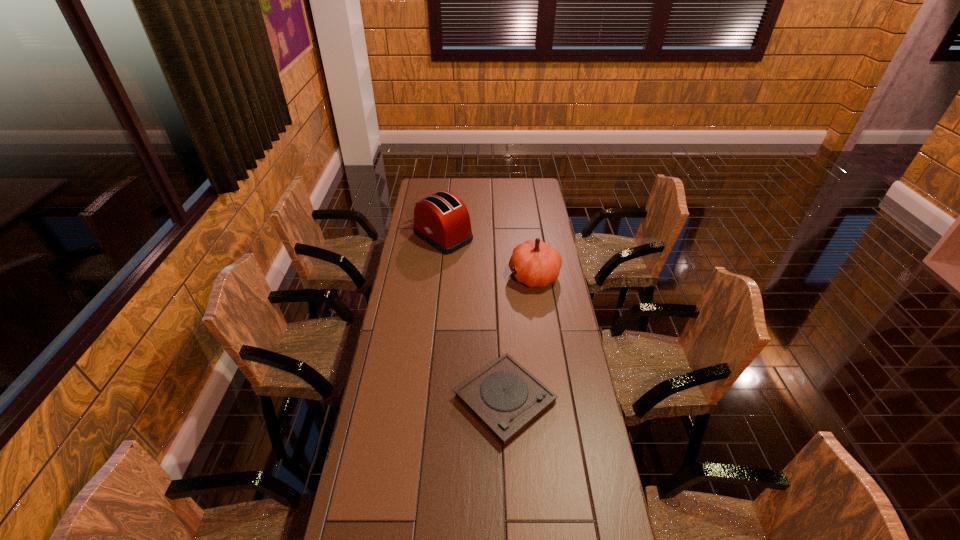
Identify which object is the nearest to the pumpkin. Please provide its 2D coordinates. Your answer should be formatted as a tuple, i.e. [(x, y)], where the tuple contains the x and y coordinates of a point satisfying the conditions above.

[(442, 220)]

The width and height of the screenshot is (960, 540). Identify the location of free location that satisfies the following two spatial constraints: 1. on the front side of the toaster; 2. on the left side of the phonograph record. (425, 400).

The image size is (960, 540). In order to click on free region that satisfies the following two spatial constraints: 1. on the front-facing side of the pumpkin; 2. on the front side of the nearest object in this screenshot , I will do `click(552, 400)`.

Image resolution: width=960 pixels, height=540 pixels. Identify the location of free spot that satisfies the following two spatial constraints: 1. on the front side of the toaster; 2. on the left side of the phonograph record. (425, 400).